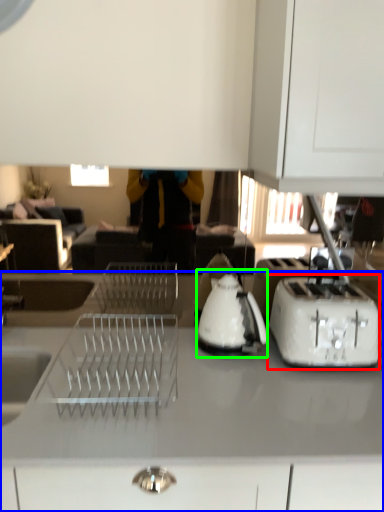
Question: Based on their relative distances, which object is farther from toaster (highlighted by a red box)? Choose from countertop (highlighted by a blue box) and kettle (highlighted by a green box).

Choices:
 (A) countertop
 (B) kettle

Answer: (A)